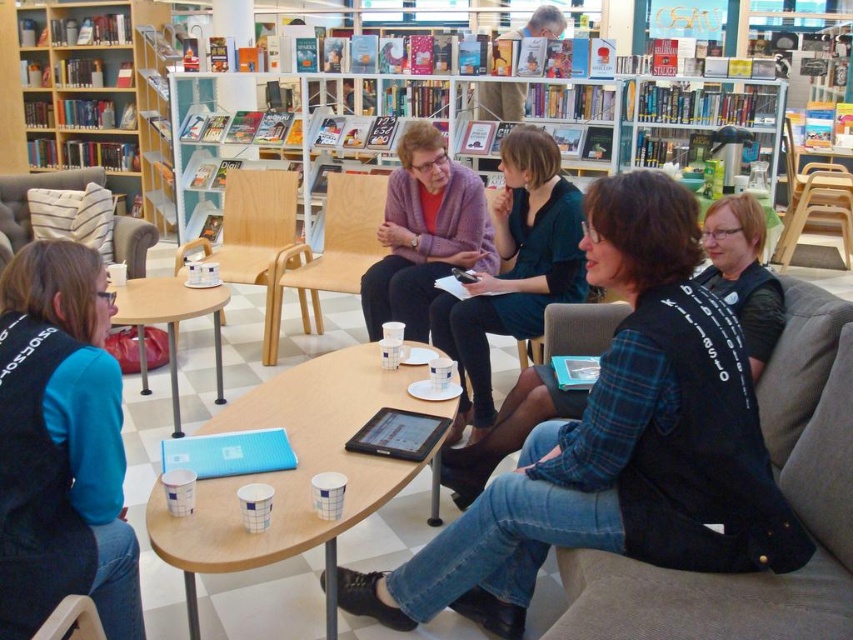
Looking at this image, does white paper cup at center appear on the left side of black fabric vest at lower right?

Correct, you'll find white paper cup at center to the left of black fabric vest at lower right.

Is point (316, 397) more distant than point (775, 330)?

Yes.

Which is behind, point (322, 436) or point (723, 260)?

Positioned behind is point (723, 260).

This screenshot has height=640, width=853. Identify the location of white paper cup at center. (294, 468).

Can you confirm if blue fleece vest at lower left is positioned to the left of wooden bookshelf at upper center?

Incorrect, blue fleece vest at lower left is not on the left side of wooden bookshelf at upper center.

Between blue fleece vest at lower left and wooden bookshelf at upper center, which one appears on the left side from the viewer's perspective?

Positioned to the left is wooden bookshelf at upper center.

The image size is (853, 640). I want to click on blue fleece vest at lower left, so click(x=61, y=445).

From the picture: Can you confirm if dark gray fabric couch at lower right is smaller than black fabric vest at lower right?

Actually, dark gray fabric couch at lower right might be larger than black fabric vest at lower right.

Can you confirm if dark gray fabric couch at lower right is wider than black fabric vest at lower right?

Yes, dark gray fabric couch at lower right is wider than black fabric vest at lower right.

Identify the location of dark gray fabric couch at lower right. This screenshot has height=640, width=853. (782, 492).